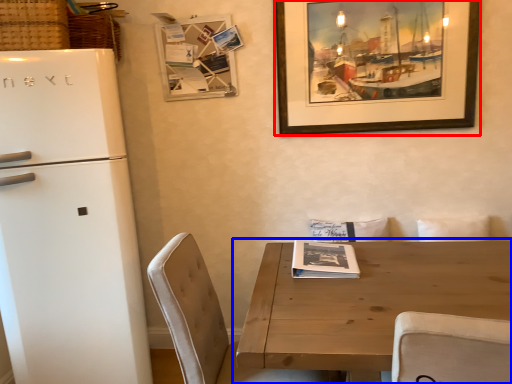
Question: Among these objects, which one is farthest to the camera, picture frame (highlighted by a red box) or table (highlighted by a blue box)?

Choices:
 (A) picture frame
 (B) table

Answer: (A)